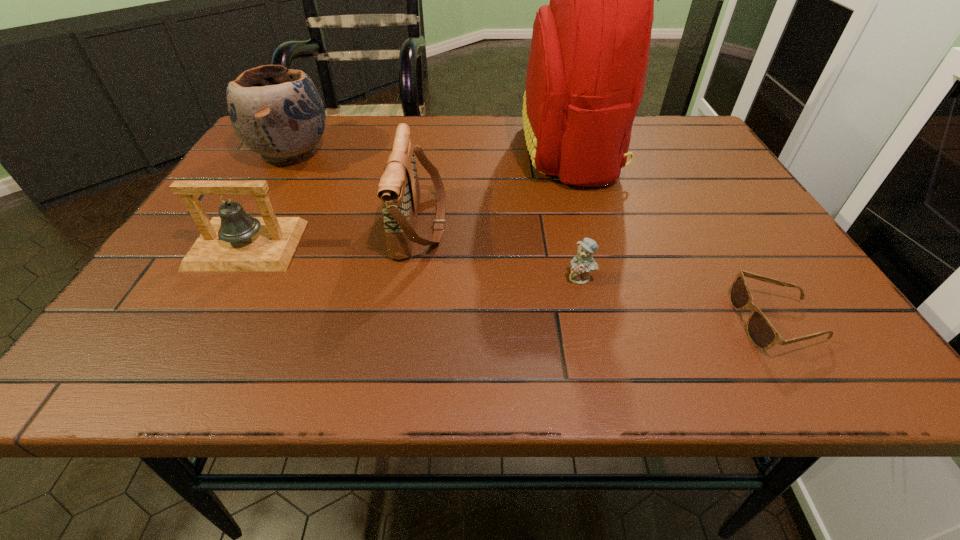
You are a GUI agent. You are given a task and a screenshot of the screen. Output one action in this format:
    pyautogui.click(x=<x>, y=<y>)
    Task: Click on the vacant area between the pottery and the bell
    
    Given the screenshot: What is the action you would take?
    pyautogui.click(x=269, y=199)

Identify the location of free space between the sunglasses and the bell. This screenshot has width=960, height=540. (512, 283).

The width and height of the screenshot is (960, 540). In order to click on free area in between the tallest object and the pottery in this screenshot , I will do `click(431, 151)`.

This screenshot has height=540, width=960. Identify the location of vacant area that lies between the third shortest object and the shoulder bag. (334, 234).

Find the location of `free spot between the second shortest object and the fourth tallest object`. free spot between the second shortest object and the fourth tallest object is located at coordinates (414, 261).

Locate an element on the screen. Image resolution: width=960 pixels, height=540 pixels. vacant point located between the teddy bear and the tallest object is located at coordinates (x=576, y=214).

The width and height of the screenshot is (960, 540). Find the location of `empty space between the shoulder bag and the shortest object`. empty space between the shoulder bag and the shortest object is located at coordinates (598, 273).

Locate an element on the screen. The image size is (960, 540). free area in between the tallest object and the teddy bear is located at coordinates (576, 214).

At what (x,y) coordinates should I click in order to perform the action: click on vacant area that lies between the fourth object from right to left and the shortest object. Please return your answer as a coordinate pair (x, y). This screenshot has width=960, height=540. Looking at the image, I should click on (598, 273).

Point out which object is positioned as the nearest to the bell. Please provide its 2D coordinates. Your answer should be formatted as a tuple, i.e. [(x, y)], where the tuple contains the x and y coordinates of a point satisfying the conditions above.

[(276, 112)]